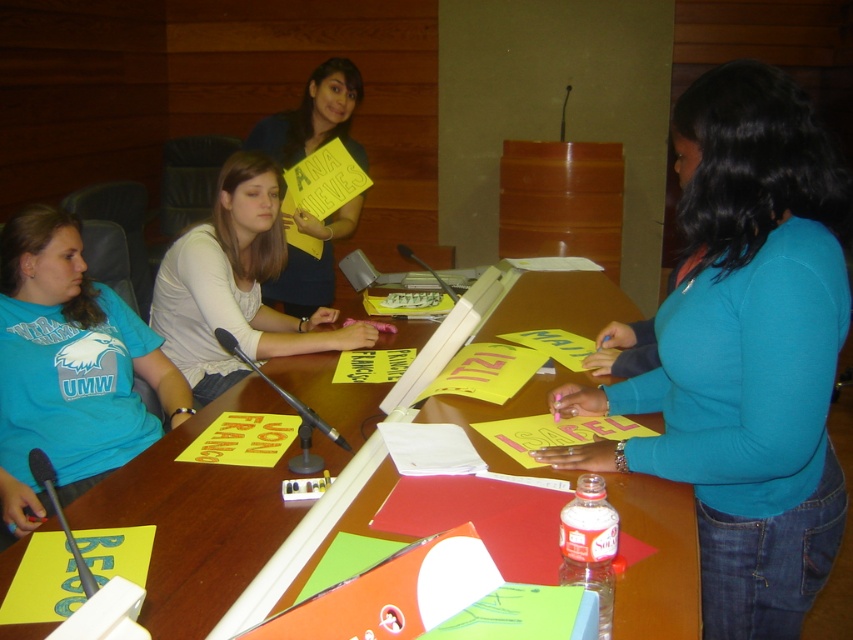
Identify the location of white matte shirt at center. The image size is (853, 640). (235, 285).

This screenshot has width=853, height=640. What are the coordinates of `white matte shirt at center` in the screenshot? It's located at (235, 285).

Between black plastic microphone at lower left and black plastic microphone at center, which one has more height?

With more height is black plastic microphone at center.

Is point (86, 586) in front of point (456, 292)?

Yes, it is in front of point (456, 292).

You are a GUI agent. You are given a task and a screenshot of the screen. Output one action in this format:
    pyautogui.click(x=<x>, y=<y>)
    Task: Click on the black plastic microphone at lower left
    The height and width of the screenshot is (640, 853).
    Given the screenshot: What is the action you would take?
    pyautogui.click(x=61, y=515)

Is wooden table at center positioned behind yellow paper sign at center?

No, it is not.

Which is in front, point (247, 388) or point (294, 262)?

Point (247, 388) is more forward.

Locate an element on the screen. The height and width of the screenshot is (640, 853). wooden table at center is located at coordinates (195, 520).